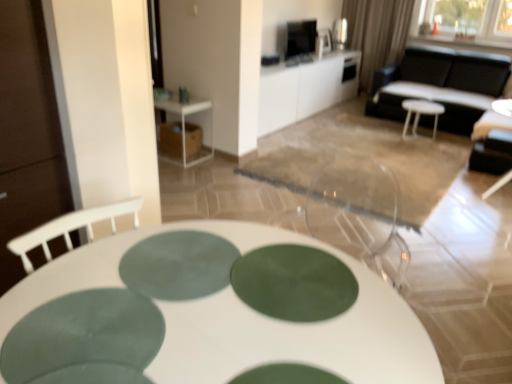
Question: Could you tell me if green fabric curtain at upper right is turned towards black leather chair at right?

Choices:
 (A) no
 (B) yes

Answer: (A)

Question: Does green fabric curtain at upper right have a greater height compared to black leather chair at right?

Choices:
 (A) yes
 (B) no

Answer: (A)

Question: Does green fabric curtain at upper right appear on the left side of black leather chair at right?

Choices:
 (A) no
 (B) yes

Answer: (B)

Question: From a real-world perspective, does green fabric curtain at upper right sit lower than black leather chair at right?

Choices:
 (A) yes
 (B) no

Answer: (B)

Question: From the image's perspective, is green fabric curtain at upper right on black leather chair at right?

Choices:
 (A) no
 (B) yes

Answer: (B)

Question: Does green fabric curtain at upper right have a lesser height compared to black leather chair at right?

Choices:
 (A) yes
 (B) no

Answer: (B)

Question: Is green matte placemat at center at the right side of white glossy cabinet at upper center, marked as the 3th table in a front-to-back arrangement?

Choices:
 (A) yes
 (B) no

Answer: (B)

Question: From a real-world perspective, is green matte placemat at center physically below white glossy cabinet at upper center, marked as the 3th table in a front-to-back arrangement?

Choices:
 (A) yes
 (B) no

Answer: (B)

Question: Is green matte placemat at center shorter than white glossy cabinet at upper center, marked as the first table in a back-to-front arrangement?

Choices:
 (A) no
 (B) yes

Answer: (B)

Question: Is white glossy cabinet at upper center, arranged as the first table when viewed from the top, at the back of green matte placemat at center?

Choices:
 (A) no
 (B) yes

Answer: (A)

Question: Considering the relative positions of green matte placemat at center and white glossy cabinet at upper center, which is the third table from bottom to top, in the image provided, is green matte placemat at center to the left of white glossy cabinet at upper center, which is the third table from bottom to top, from the viewer's perspective?

Choices:
 (A) no
 (B) yes

Answer: (B)

Question: Does green matte placemat at center lie in front of white glossy cabinet at upper center, which is the third table from bottom to top?

Choices:
 (A) no
 (B) yes

Answer: (B)

Question: Can you confirm if white plastic stool at center is taller than white plastic side table at upper left, the second table in the top-to-bottom sequence?

Choices:
 (A) no
 (B) yes

Answer: (A)